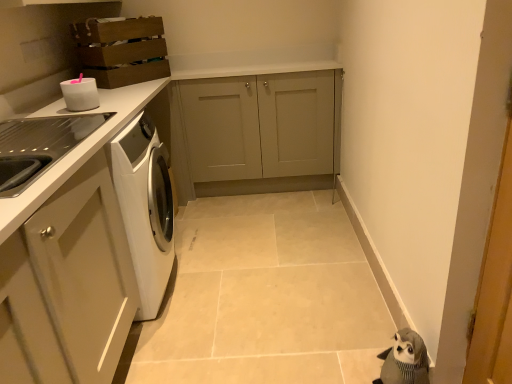
Question: From a real-world perspective, is matte gray cabinet at center, the second cabinetry viewed from the left, physically located above or below white glossy container at upper left?

Choices:
 (A) above
 (B) below

Answer: (B)

Question: Considering their positions, is matte gray cabinet at center, the second cabinetry viewed from the left, located in front of or behind white glossy container at upper left?

Choices:
 (A) front
 (B) behind

Answer: (B)

Question: Which object is positioned closest to the matte gray cabinet at center, placed as the first cabinetry when sorted from right to left?

Choices:
 (A) white glossy sink at left
 (B) white glossy countertop at left
 (C) white glossy container at upper left
 (D) wooden crate at upper left, the second cabinetry when ordered from right to left

Answer: (D)

Question: Estimate the real-world distances between objects in this image. Which object is closer to the matte gray cabinet at center, the second cabinetry viewed from the left?

Choices:
 (A) white glossy container at upper left
 (B) white glossy sink at left
 (C) wooden crate at upper left, the second cabinetry when ordered from right to left
 (D) white glossy countertop at left

Answer: (C)